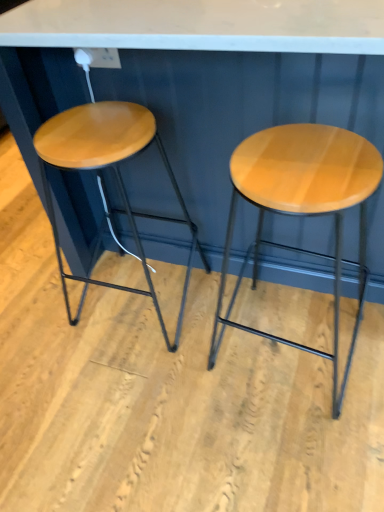
Question: Can you confirm if matte wood stool at center, acting as the second stool starting from the left, is taller than matte wood stool at left, the 1th stool viewed from the left?

Choices:
 (A) yes
 (B) no

Answer: (A)

Question: Can you confirm if matte wood stool at center, the first stool positioned from the right, is wider than matte wood stool at left, positioned as the 2th stool in right-to-left order?

Choices:
 (A) no
 (B) yes

Answer: (B)

Question: From the image's perspective, does matte wood stool at center, the first stool positioned from the right, appear higher than matte wood stool at left, the 1th stool viewed from the left?

Choices:
 (A) yes
 (B) no

Answer: (B)

Question: Can you confirm if matte wood stool at center, the first stool positioned from the right, is bigger than matte wood stool at left, positioned as the 2th stool in right-to-left order?

Choices:
 (A) no
 (B) yes

Answer: (B)

Question: Is matte wood stool at center, the first stool positioned from the right, positioned with its back to matte wood stool at left, positioned as the 2th stool in right-to-left order?

Choices:
 (A) no
 (B) yes

Answer: (A)

Question: From the image's perspective, is matte wood stool at center, acting as the second stool starting from the left, below matte wood stool at left, the 1th stool viewed from the left?

Choices:
 (A) no
 (B) yes

Answer: (B)

Question: Is matte wood stool at left, the 1th stool viewed from the left, smaller than matte wood stool at center, the first stool positioned from the right?

Choices:
 (A) no
 (B) yes

Answer: (B)

Question: Is matte wood stool at left, the 1th stool viewed from the left, wider than matte wood stool at center, the first stool positioned from the right?

Choices:
 (A) no
 (B) yes

Answer: (A)

Question: Is matte wood stool at left, the 1th stool viewed from the left, further to the viewer compared to matte wood stool at center, the first stool positioned from the right?

Choices:
 (A) yes
 (B) no

Answer: (A)

Question: Can you confirm if matte wood stool at left, the 1th stool viewed from the left, is taller than matte wood stool at center, the first stool positioned from the right?

Choices:
 (A) no
 (B) yes

Answer: (A)

Question: From a real-world perspective, does matte wood stool at left, the 1th stool viewed from the left, stand above matte wood stool at center, the first stool positioned from the right?

Choices:
 (A) yes
 (B) no

Answer: (A)

Question: Is matte wood stool at left, the 1th stool viewed from the left, aimed at matte wood stool at center, acting as the second stool starting from the left?

Choices:
 (A) no
 (B) yes

Answer: (A)

Question: Does point (294, 146) appear closer or farther from the camera than point (64, 158)?

Choices:
 (A) farther
 (B) closer

Answer: (B)